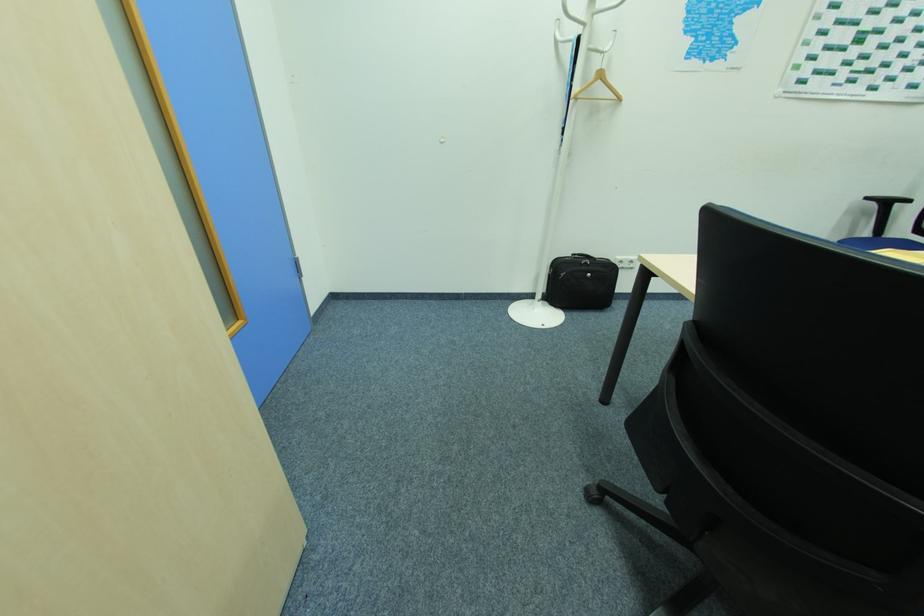
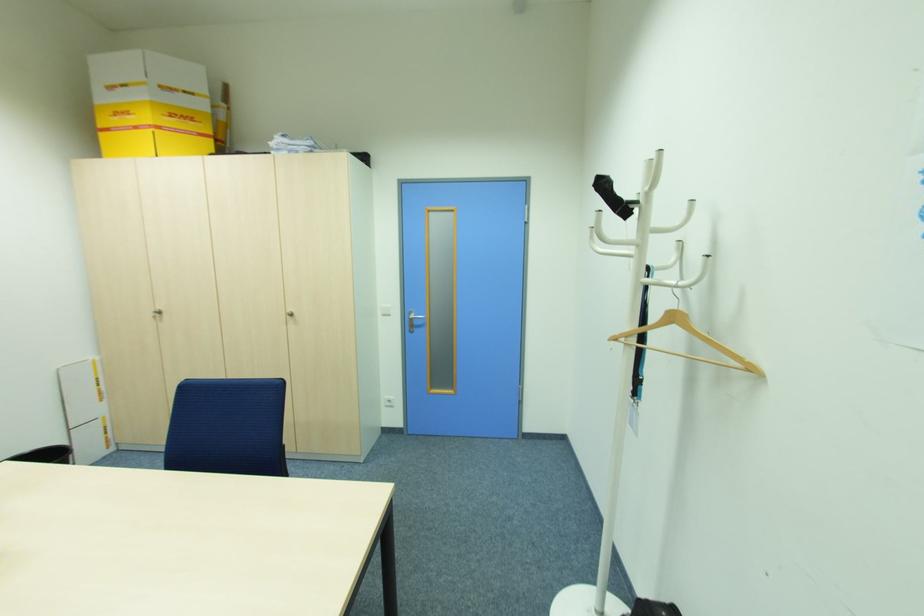
In the second image, find the point that corresponds to pixel 622 99 in the first image.

(756, 370)